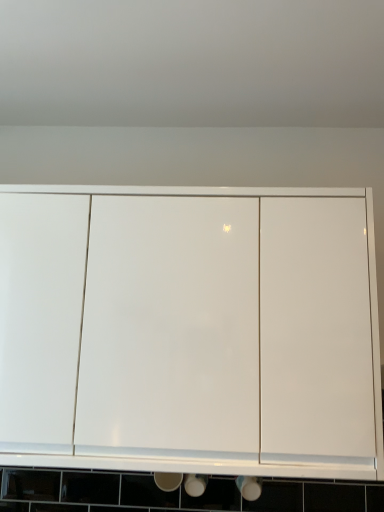
Where is `white glossy cupboard at center`? Image resolution: width=384 pixels, height=512 pixels. white glossy cupboard at center is located at coordinates (223, 326).

From the picture: Measure the distance between white glossy cupboard at center and camera.

They are 3.60 feet apart.

This screenshot has width=384, height=512. Describe the element at coordinates (223, 326) in the screenshot. I see `white glossy cupboard at center` at that location.

Identify the location of white glossy cupboard at center. The image size is (384, 512). (223, 326).